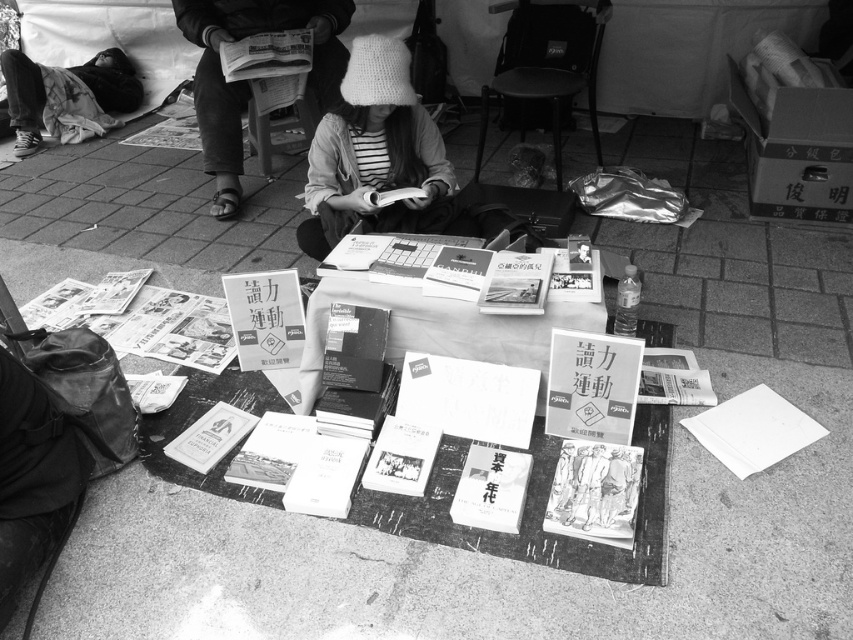
Question: Which point is farther from the camera taking this photo?

Choices:
 (A) (363, 88)
 (B) (776, 440)

Answer: (A)

Question: Which of the following is the farthest from the observer?

Choices:
 (A) white knit hat at upper center
 (B) white knitted hat at center

Answer: (A)

Question: Is white knitted hat at center behind white knit hat at upper center?

Choices:
 (A) no
 (B) yes

Answer: (A)

Question: Does white knit hat at upper center come behind white paper at lower right?

Choices:
 (A) yes
 (B) no

Answer: (A)

Question: Does white knitted hat at center come in front of white paper at lower right?

Choices:
 (A) no
 (B) yes

Answer: (A)

Question: Based on their relative distances, which object is nearer to the white knitted hat at center?

Choices:
 (A) white knit hat at upper center
 (B) white paper at lower right

Answer: (A)